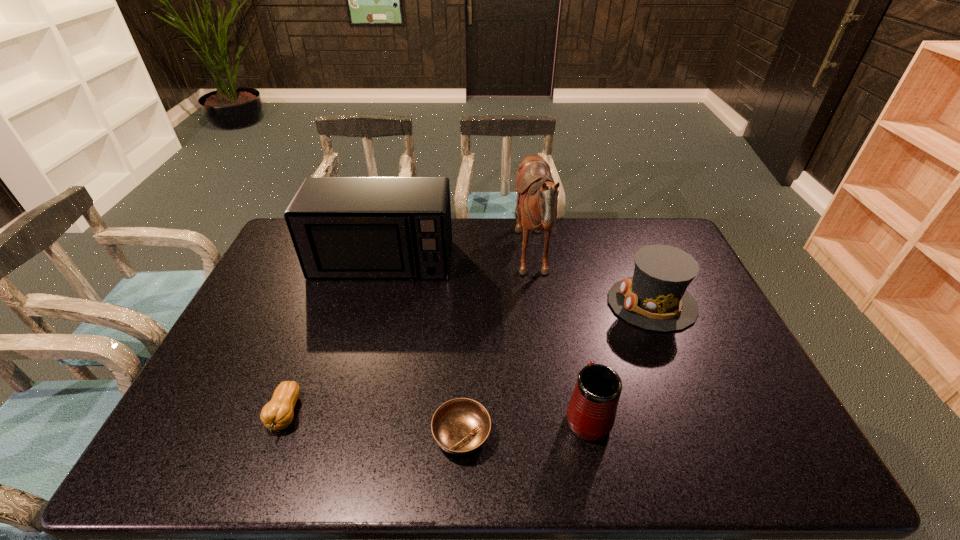
Find the location of a particular element. The image size is (960, 540). vacant space that satisfies the following two spatial constraints: 1. on the side of the mug with the handle; 2. on the back of the saddle is located at coordinates (556, 262).

Identify the location of free spot that satisfies the following two spatial constraints: 1. on the front-facing side of the fifth shortest object; 2. on the left side of the shortest object. (335, 435).

In order to click on free space in the image that satisfies the following two spatial constraints: 1. on the front-facing side of the shortest object; 2. on the right side of the second tallest object in this screenshot , I will do `click(335, 435)`.

Where is `free spot that satisfies the following two spatial constraints: 1. on the back of the saddle; 2. on the side of the mug with the handle`? The image size is (960, 540). free spot that satisfies the following two spatial constraints: 1. on the back of the saddle; 2. on the side of the mug with the handle is located at coordinates (554, 415).